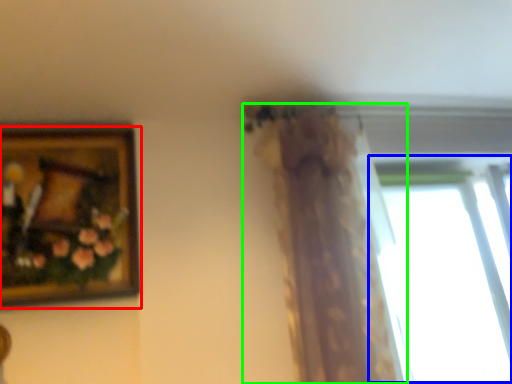
Question: Based on their relative distances, which object is farther from picture frame (highlighted by a red box)? Choose from window (highlighted by a blue box) and curtain (highlighted by a green box).

Choices:
 (A) window
 (B) curtain

Answer: (A)